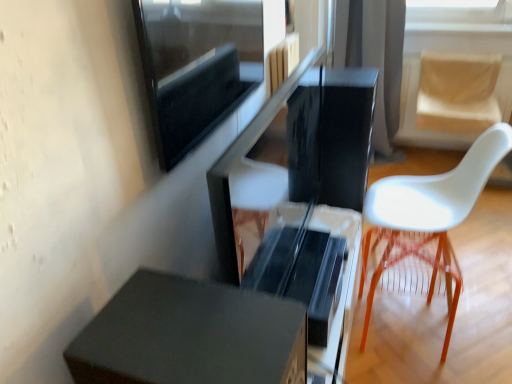
I want to click on free point below translucent orange stool at right (from a real-world perspective), so click(399, 331).